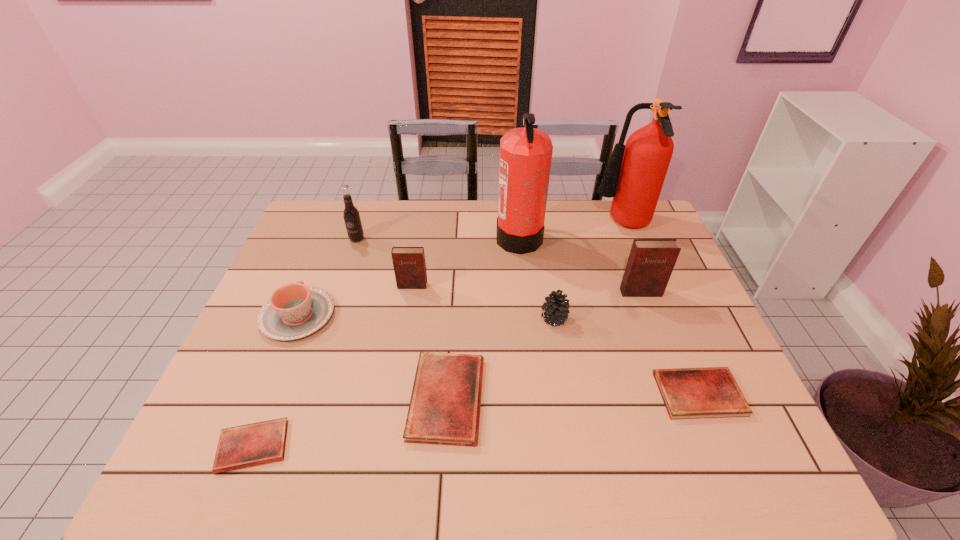
Where is `pink chinaware`? The width and height of the screenshot is (960, 540). pink chinaware is located at coordinates (294, 311).

This screenshot has width=960, height=540. Find the location of `the third shortest diary`. the third shortest diary is located at coordinates (444, 409).

The height and width of the screenshot is (540, 960). Identify the location of the second red diary from left to right. (444, 409).

The image size is (960, 540). In order to click on the rightmost red diary in this screenshot , I will do coord(688,393).

You are a GUI agent. You are given a task and a screenshot of the screen. Output one action in this format:
    pyautogui.click(x=<x>, y=<y>)
    Task: Click on the fourth tallest diary
    The height and width of the screenshot is (540, 960).
    Given the screenshot: What is the action you would take?
    pyautogui.click(x=688, y=393)

Find the location of a particular element. The height and width of the screenshot is (540, 960). the leftmost red diary is located at coordinates (259, 443).

Identify the location of the smallest red diary. (259, 443).

Where is `vacant area situated 0.190m on the front side of the black fire extinguisher`? The height and width of the screenshot is (540, 960). vacant area situated 0.190m on the front side of the black fire extinguisher is located at coordinates (440, 236).

Locate an element on the screen. free space located on the front side of the black fire extinguisher is located at coordinates (395, 236).

The height and width of the screenshot is (540, 960). I want to click on vacant region located 0.180m on the front side of the black fire extinguisher, so click(443, 236).